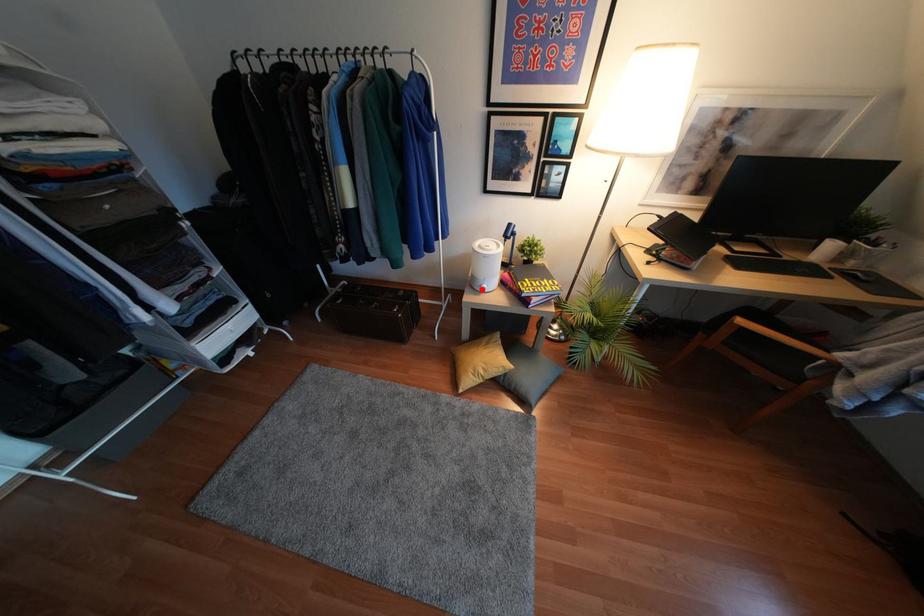
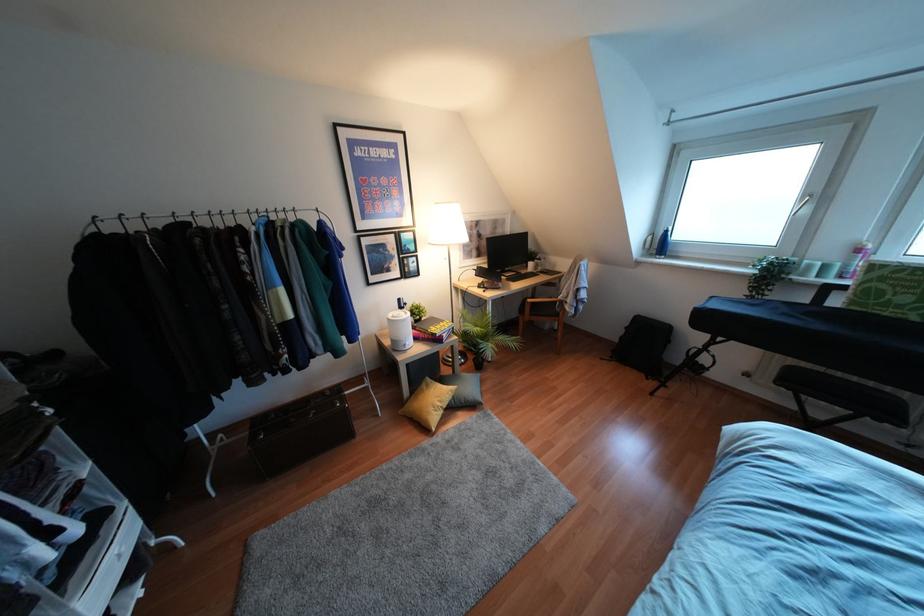
The point at the highlighted location is marked in the first image. Where is the corresponding point in the second image?

(407, 347)